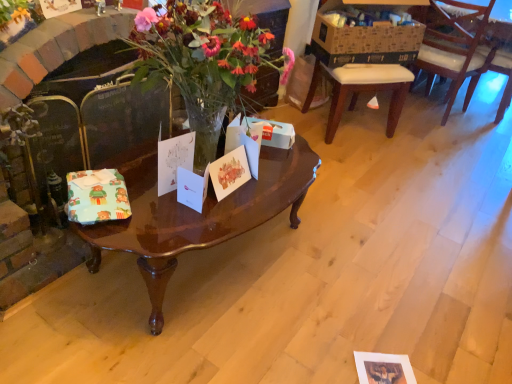
Question: Does white paper gift card at center, which is counted as the 2th gift card, starting from the right, have a smaller size compared to white paper gift card at center, the first gift card from the right?

Choices:
 (A) yes
 (B) no

Answer: (A)

Question: Considering the relative positions of white paper gift card at center, which is counted as the 2th gift card, starting from the right, and white paper gift card at center, the first gift card from the right, in the image provided, is white paper gift card at center, which is counted as the 2th gift card, starting from the right, to the right of white paper gift card at center, the first gift card from the right, from the viewer's perspective?

Choices:
 (A) yes
 (B) no

Answer: (B)

Question: Is white paper gift card at center, arranged as the third gift card when viewed from the left, thinner than white paper gift card at center, the first gift card from the right?

Choices:
 (A) no
 (B) yes

Answer: (A)

Question: From a real-world perspective, is white paper gift card at center, arranged as the third gift card when viewed from the left, physically above white paper gift card at center, the first gift card from the right?

Choices:
 (A) yes
 (B) no

Answer: (A)

Question: From the image's perspective, is white paper gift card at center, which is counted as the 2th gift card, starting from the right, on white paper gift card at center, the first gift card from the right?

Choices:
 (A) yes
 (B) no

Answer: (B)

Question: Considering the relative sizes of white paper gift card at center, which is counted as the 2th gift card, starting from the right, and white paper gift card at center, the first gift card from the right, in the image provided, is white paper gift card at center, which is counted as the 2th gift card, starting from the right, taller than white paper gift card at center, the first gift card from the right,?

Choices:
 (A) no
 (B) yes

Answer: (B)

Question: From the image's perspective, does wooden chair at right appear lower than brown cardboard box at upper right?

Choices:
 (A) no
 (B) yes

Answer: (B)

Question: Is wooden chair at right outside of brown cardboard box at upper right?

Choices:
 (A) yes
 (B) no

Answer: (A)

Question: Considering the relative sizes of wooden chair at right and brown cardboard box at upper right in the image provided, is wooden chair at right smaller than brown cardboard box at upper right?

Choices:
 (A) yes
 (B) no

Answer: (B)

Question: Is wooden chair at right taller than brown cardboard box at upper right?

Choices:
 (A) yes
 (B) no

Answer: (A)

Question: Is wooden chair at right facing away from brown cardboard box at upper right?

Choices:
 (A) no
 (B) yes

Answer: (B)

Question: Are wooden chair at right and brown cardboard box at upper right located far from each other?

Choices:
 (A) yes
 (B) no

Answer: (B)

Question: Can you confirm if white paper gift card at center, which is counted as the 2th gift card, starting from the right, is bigger than white paper gift card at center, arranged as the third gift card when viewed from the right?

Choices:
 (A) no
 (B) yes

Answer: (A)